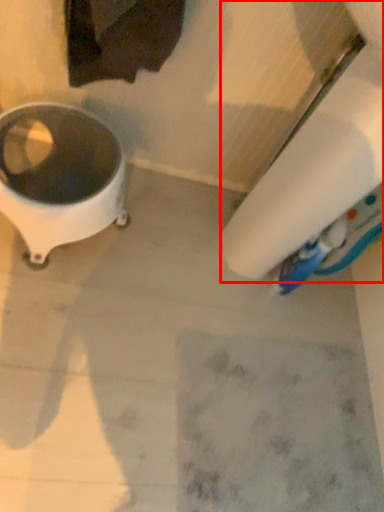
Question: From the image's perspective, what is the correct spatial relationship of toilet paper (annotated by the red box) in relation to waste container?

Choices:
 (A) above
 (B) below

Answer: (A)